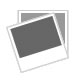
Find the location of a particular element. The image size is (80, 80). writing area is located at coordinates (40, 60).